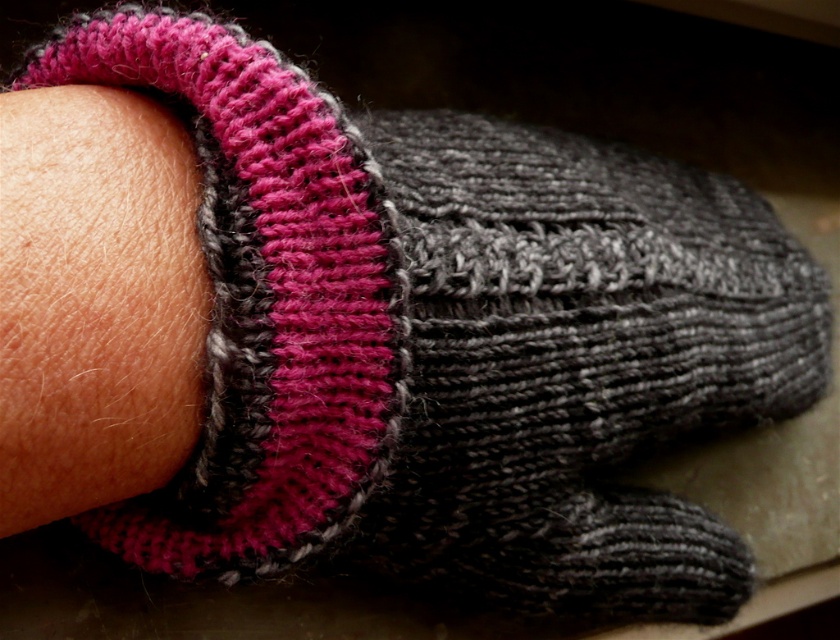
You are a photographer trying to capture a detailed closeup of the knitted item. You want to ensure the point at point (185, 280) is in focus. If your camera has a depth of field that can sharply focus objects within 15 inches from the current focus point, what is the closest distance you should set the focus to so that the point remains in focus?

To ensure the point at point (185, 280) stays within the 15 inches depth of field, set the focus point no closer than 5.91 inches from it. Since the point is 20.91 inches away, subtract half the depth of field range. The focus should be set between 20.91 minus 7.5 inches, resulting in 13.41 inches from the camera. This keeps the point within the 15 inch range.

You are examining the knitted item and want to determine which of the two points, point (88, 292) or point (260, 189), is closer to you. Based on the image, which point is nearer?

Point (88, 292) is closer to the viewer than point (260, 189).